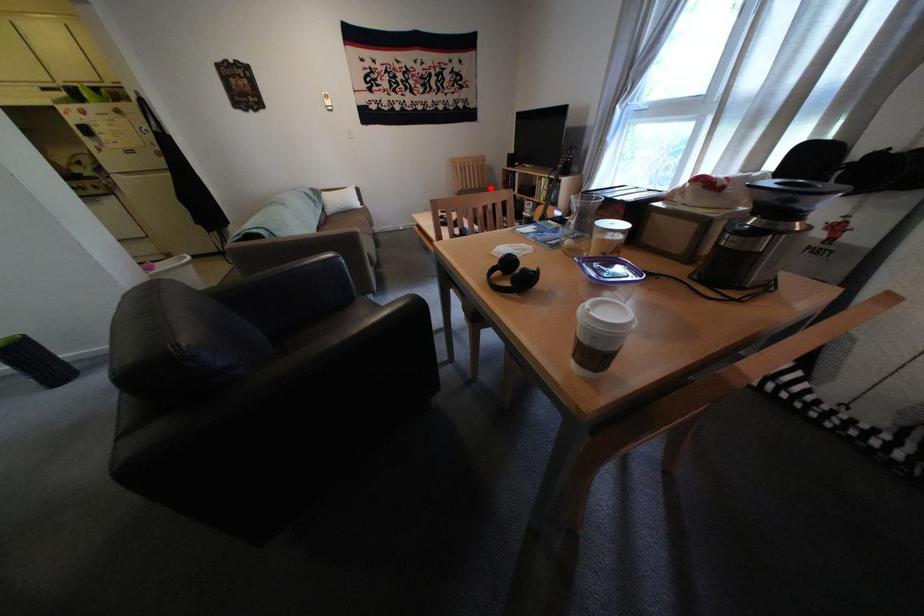
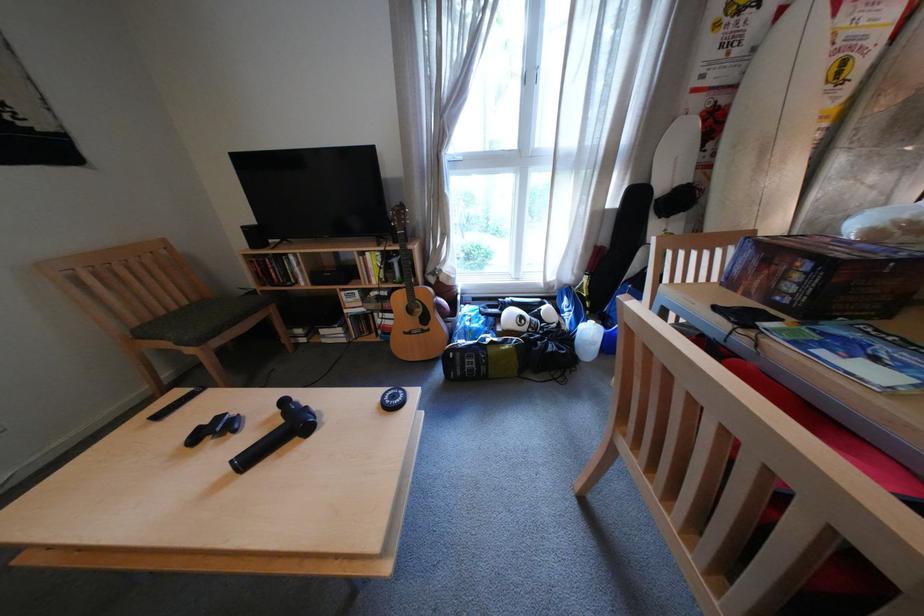
Where in the second image is the point corresponding to the highlighted location from the first image?

(199, 304)